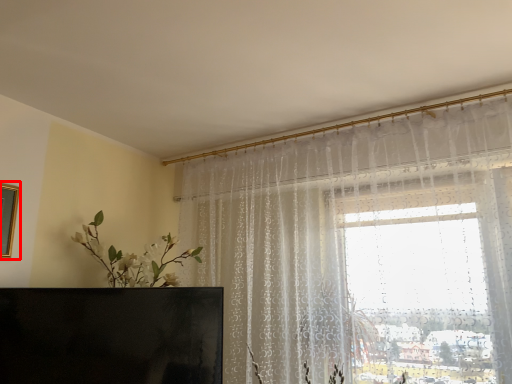
Question: From the image's perspective, where is picture frame (annotated by the red box) located relative to furniture?

Choices:
 (A) above
 (B) below

Answer: (A)